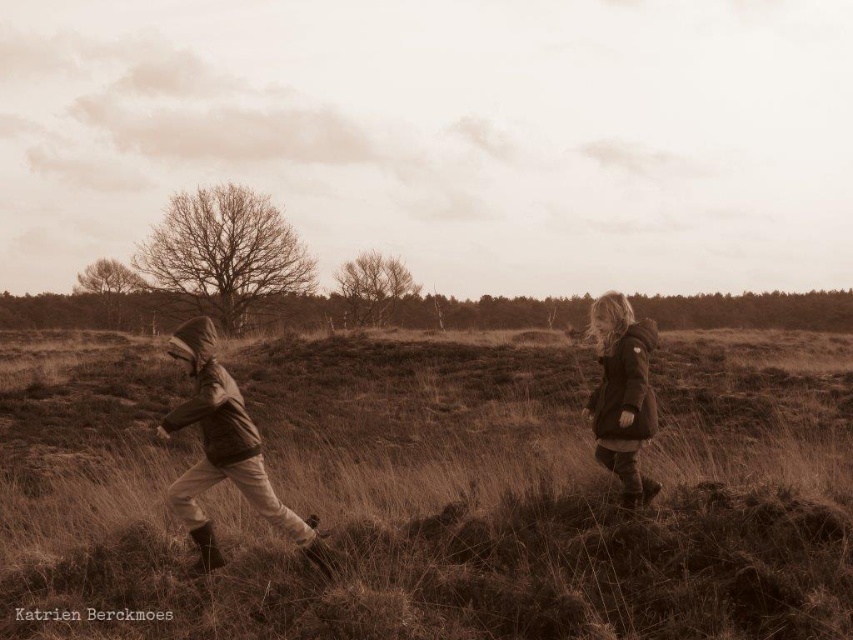
You are a photographer analyzing this vintage image of two children in jackets. The scene shows them running in a field with a sepia tone. You need to determine which jacket, the brown matte jacket at left or the matte brown jacket at right, is taller. Based on the description, which one is taller?

The brown matte jacket at left has a greater height compared to the matte brown jacket at right, so the brown matte jacket at left is taller.

The two children are running through the brown grassy at center. How far apart are they?

The two children are 5.47 meters apart.

You are a photographer trying to capture a photo of both children wearing jackets in the field. If you want to ensure both the brown matte jacket at left and the matte brown jacket at right are in focus, what is the minimum distance you should set your camera lens to?

The minimum distance should be set to 9.83 feet to ensure both jackets are in focus since they are 9.83 feet apart.